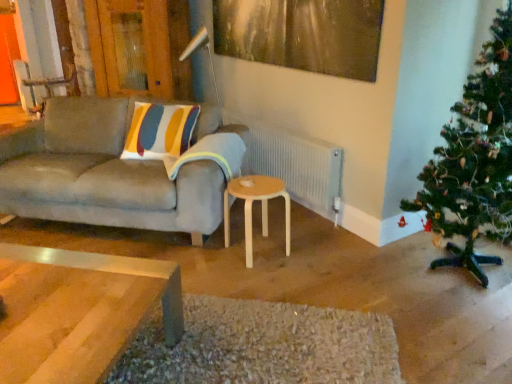
Question: Is white textured radiator at center bigger or smaller than wooden armchair at upper left?

Choices:
 (A) small
 (B) big

Answer: (A)

Question: Based on their positions, is white textured radiator at center located to the left or right of wooden armchair at upper left?

Choices:
 (A) right
 (B) left

Answer: (A)

Question: Estimate the real-world distances between objects in this image. Which object is closer to the matte gray couch at left?

Choices:
 (A) wooden armchair at upper left
 (B) natural wood stool at center
 (C) metallic gold painting at upper center
 (D) green textured christmas tree at right
 (E) metallic silver lamp at upper center

Answer: (B)

Question: Which object is the closest to the white textured radiator at center?

Choices:
 (A) matte gray couch at left
 (B) metallic gold painting at upper center
 (C) metallic silver lamp at upper center
 (D) green textured christmas tree at right
 (E) striped fabric pillow at center

Answer: (E)